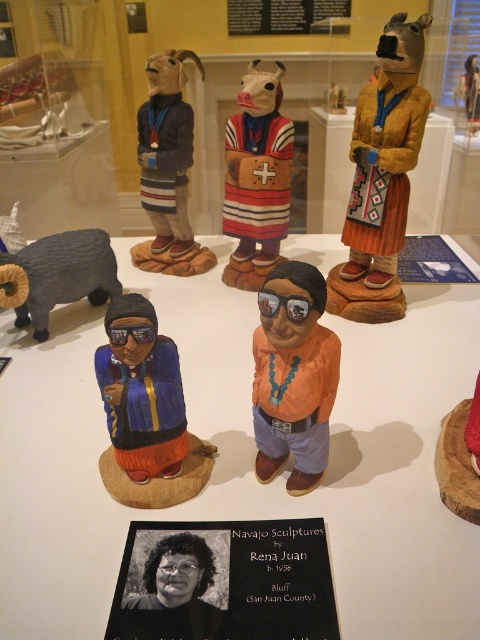
Question: Which of the following is the closest to the observer?

Choices:
 (A) (298, 426)
 (B) (190, 228)
 (C) (282, 577)

Answer: (C)

Question: Which point appears closest to the camera in this image?

Choices:
 (A) (194, 552)
 (B) (334, 333)
 (C) (445, 572)
 (D) (152, 77)

Answer: (C)

Question: Which object appears closest to the camera in this image?

Choices:
 (A) white wood table at center
 (B) black glossy photo at center

Answer: (B)

Question: Does matte blue wood figure at center appear over black glossy photo at center?

Choices:
 (A) no
 (B) yes

Answer: (B)

Question: From the image, what is the correct spatial relationship of black paper at center in relation to gray matte ram at lower left?

Choices:
 (A) right
 (B) left

Answer: (A)

Question: Is white wood table at center to the left of matte black kachina doll at upper left from the viewer's perspective?

Choices:
 (A) no
 (B) yes

Answer: (A)